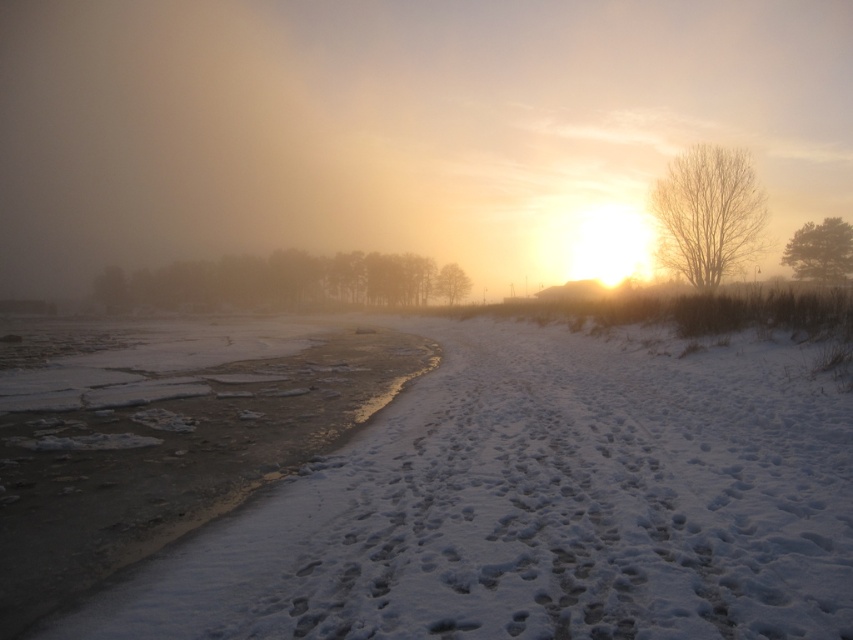
You are an artist planning to paint the winter scene. You want to ensure the bare branches at right and the smooth brown tree at center are proportionally accurate. Which object should you draw wider in your painting?

The bare branches at right should be drawn wider in the painting since their width surpasses that of the smooth brown tree at center according to the description.